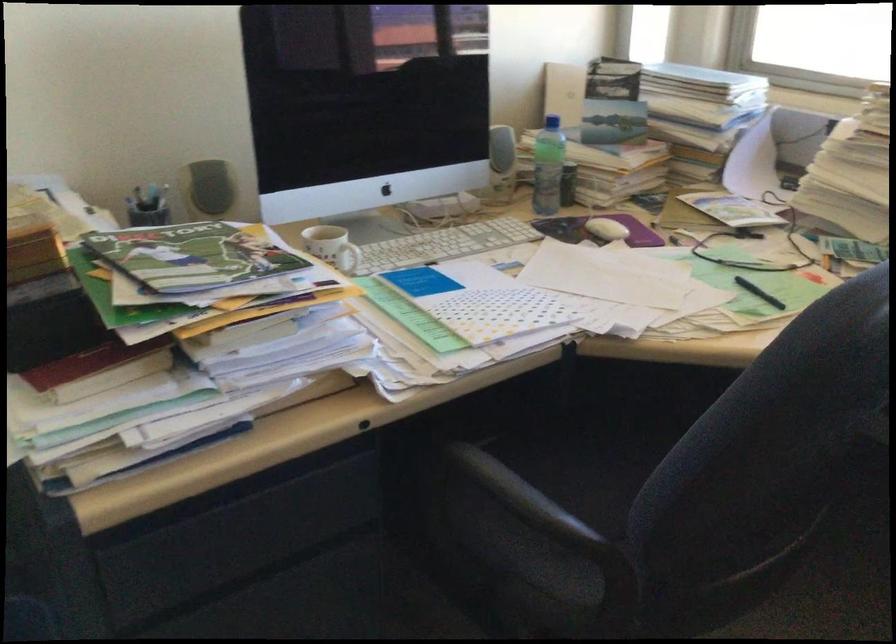
Identify the location of green water bottle. The image size is (896, 644). (547, 167).